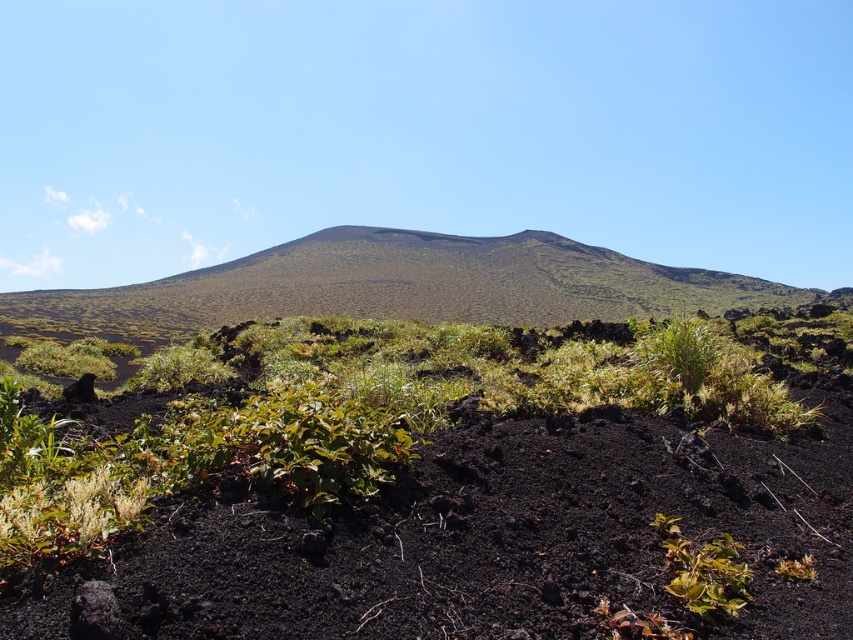
You are a hiker exploring the volcanic landscape and want to take a photo of the green shrubs at center and the green grassy hillside at center. Which object should you focus on first if you want to capture both in a single frame without moving the camera?

The green shrubs at center should be focused on first because it is positioned on the right side of the green grassy hillside at center, so adjusting the camera frame to include both would require ensuring the shrubs are within the right side of the frame.

In the scene shown: You are a hiker standing at the edge of the volcanic landscape. You see the green shrubs at center and the green grassy hillside at center. Which one is shorter?

The green shrubs at center are shorter than the green grassy hillside at center.

You are a hiker standing on the volcanic landscape and want to reach the top of the green grassy hillside at center. Which direction should you move relative to the green shrubs at center to ascend?

To ascend to the top of the green grassy hillside at center, you should move upward from the green shrubs at center since the green shrubs at center are located below the green grassy hillside at center.